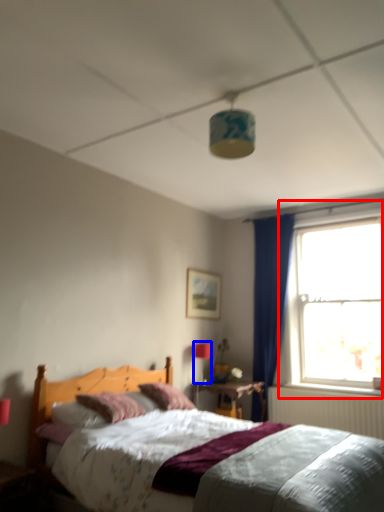
Question: Which object appears closest to the camera in this image, window (highlighted by a red box) or light fixture (highlighted by a blue box)?

Choices:
 (A) window
 (B) light fixture

Answer: (A)